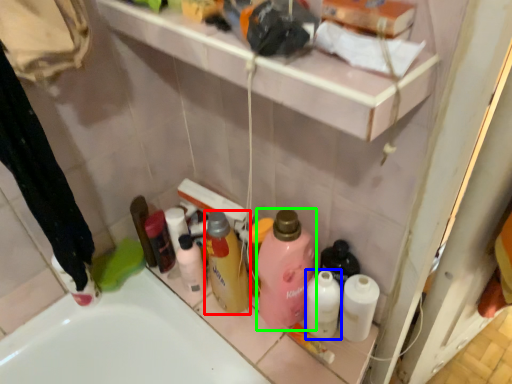
Question: Considering the real-world distances, which object is farthest from cleaning product (highlighted by a red box)? toiletry (highlighted by a blue box) or cleaning product (highlighted by a green box)?

Choices:
 (A) toiletry
 (B) cleaning product

Answer: (A)